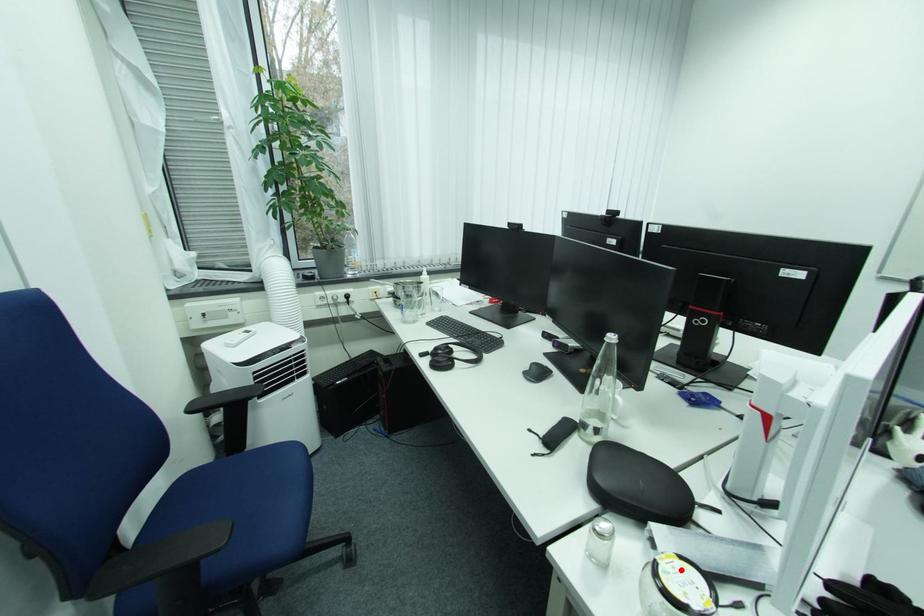
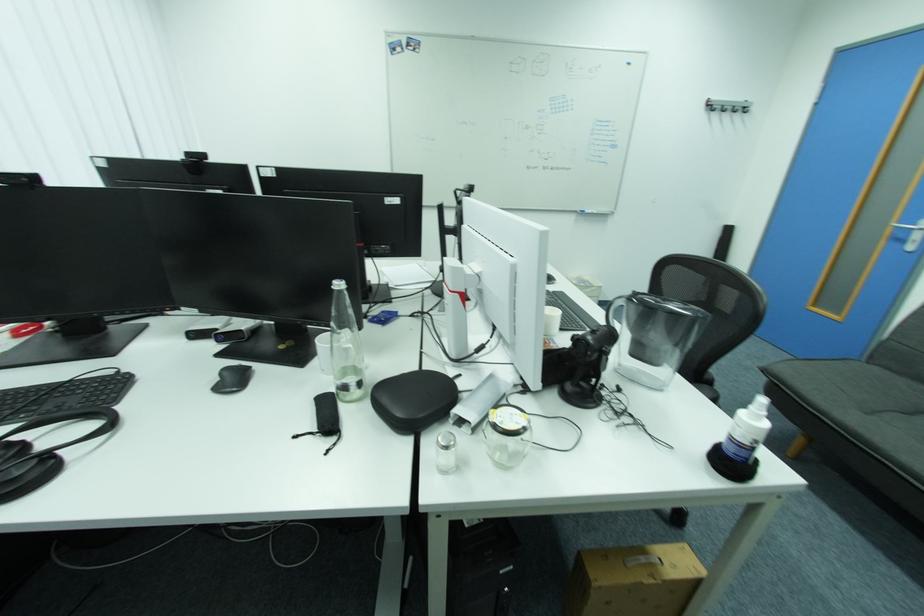
Find the pixel in the second image that matches the highlighted location in the first image.

(506, 418)